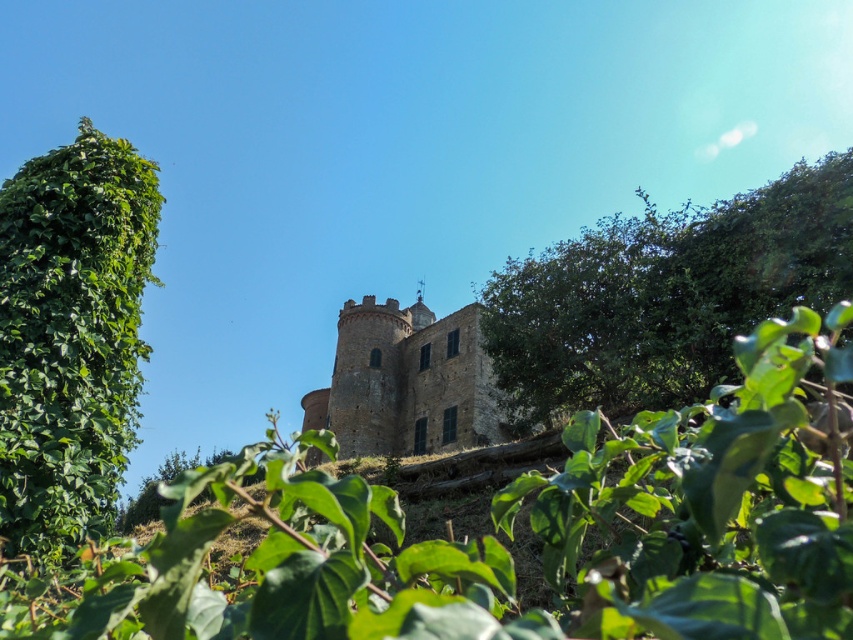
Is green leafy tree at left thinner than brown stone castle at center?

Yes.

Does green leafy tree at left appear over brown stone castle at center?

Indeed, green leafy tree at left is positioned over brown stone castle at center.

Find the location of `green leafy tree at left`. green leafy tree at left is located at coordinates (71, 337).

This screenshot has height=640, width=853. Identify the location of green leafy tree at left. (71, 337).

Consider the image. Can you confirm if green leafy tree at upper right is thinner than green leafy tree at left?

No.

Is green leafy tree at upper right taller than green leafy tree at left?

Yes.

Find the location of a particular element. The width and height of the screenshot is (853, 640). green leafy tree at upper right is located at coordinates (664, 296).

Is green leafy tree at upper right wider than brown stone castle at center?

In fact, green leafy tree at upper right might be narrower than brown stone castle at center.

Does green leafy tree at upper right appear on the left side of brown stone castle at center?

No, green leafy tree at upper right is not to the left of brown stone castle at center.

Who is more distant from viewer, (618, 301) or (345, 444)?

The point (345, 444) is behind.

Identify the location of green leafy tree at upper right. (664, 296).